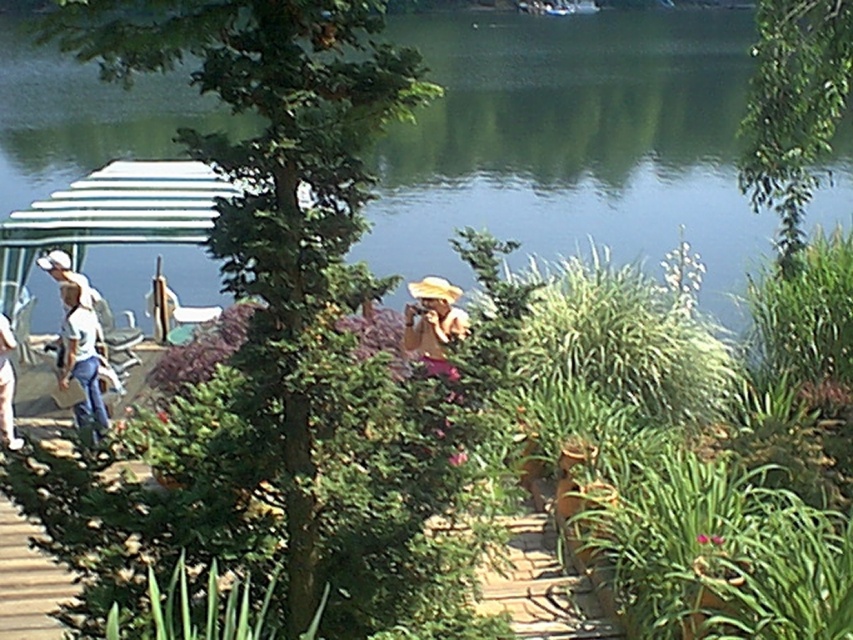
Does point (55, 596) come closer to viewer compared to point (206, 630)?

No, (55, 596) is further to viewer.

Does point (57, 438) come closer to viewer compared to point (189, 605)?

No.

Where is `wooden deck at lower left`? wooden deck at lower left is located at coordinates (28, 580).

Is point (22, 605) positioned in front of point (416, 332)?

Yes, it is.

Does wooden deck at lower left appear on the right side of pink fabric at center?

In fact, wooden deck at lower left is to the left of pink fabric at center.

Identify the location of wooden deck at lower left. This screenshot has width=853, height=640. (28, 580).

Locate an element on the screen. This screenshot has height=640, width=853. green water at center is located at coordinates (573, 141).

Which is more to the right, green water at center or green leafy plant at center?

Positioned to the right is green water at center.

What are the coordinates of `green water at center` in the screenshot? It's located at (573, 141).